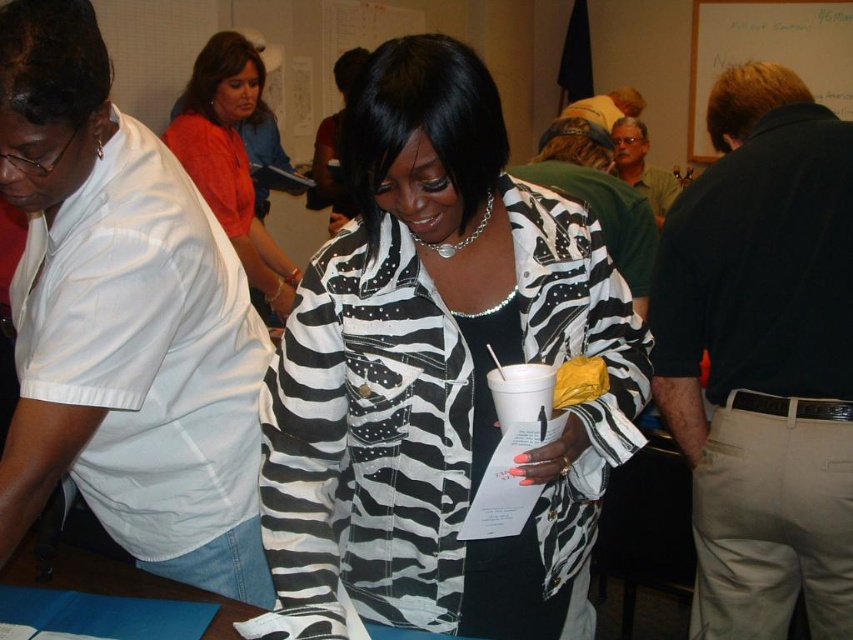
You are organizing a fashion show and need to decide which outfit to feature first. Based on the image, which item is wider, the matte red blouse at upper left or the zebra print jacket at center?

The matte red blouse at upper left might be wider than the zebra print jacket at center according to the description.

You are at a networking event and need to present your project. You see a dark brown cotton polo shirt at upper right and a white paperboard at upper right. Which object is closer to you for using as a presentation aid?

The dark brown cotton polo shirt at upper right is in front of the white paperboard at upper right, so it is closer to you and can be used as a presentation aid.